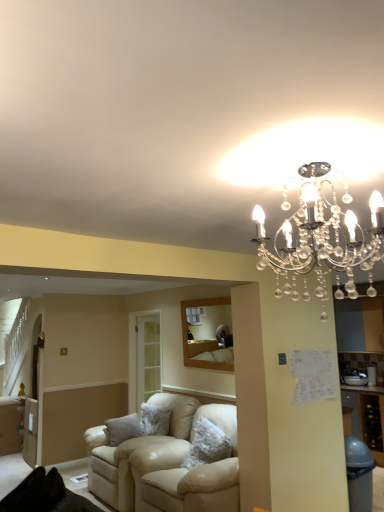
Question: Considering the relative sizes of beige leather couch at center and clear crystal chandelier at upper center in the image provided, is beige leather couch at center thinner than clear crystal chandelier at upper center?

Choices:
 (A) no
 (B) yes

Answer: (A)

Question: Is beige leather couch at center looking in the opposite direction of clear crystal chandelier at upper center?

Choices:
 (A) yes
 (B) no

Answer: (B)

Question: Is beige leather couch at center in front of clear crystal chandelier at upper center?

Choices:
 (A) yes
 (B) no

Answer: (B)

Question: Does beige leather couch at center come behind clear crystal chandelier at upper center?

Choices:
 (A) no
 (B) yes

Answer: (B)

Question: Can you confirm if beige leather couch at center is smaller than clear crystal chandelier at upper center?

Choices:
 (A) no
 (B) yes

Answer: (A)

Question: Can you confirm if beige leather couch at center is wider than clear crystal chandelier at upper center?

Choices:
 (A) yes
 (B) no

Answer: (A)

Question: Considering the relative positions of clear crystal chandelier at upper center and beige leather couch at center in the image provided, is clear crystal chandelier at upper center to the right of beige leather couch at center from the viewer's perspective?

Choices:
 (A) yes
 (B) no

Answer: (A)

Question: Is clear crystal chandelier at upper center aimed at beige leather couch at center?

Choices:
 (A) yes
 (B) no

Answer: (B)

Question: Is clear crystal chandelier at upper center facing away from beige leather couch at center?

Choices:
 (A) no
 (B) yes

Answer: (A)

Question: Does clear crystal chandelier at upper center have a lesser height compared to beige leather couch at center?

Choices:
 (A) no
 (B) yes

Answer: (B)

Question: Is clear crystal chandelier at upper center positioned far away from beige leather couch at center?

Choices:
 (A) no
 (B) yes

Answer: (B)

Question: Can you confirm if clear crystal chandelier at upper center is taller than beige leather couch at center?

Choices:
 (A) no
 (B) yes

Answer: (A)

Question: From the image's perspective, is beige leather couch at center above or below clear crystal chandelier at upper center?

Choices:
 (A) above
 (B) below

Answer: (B)